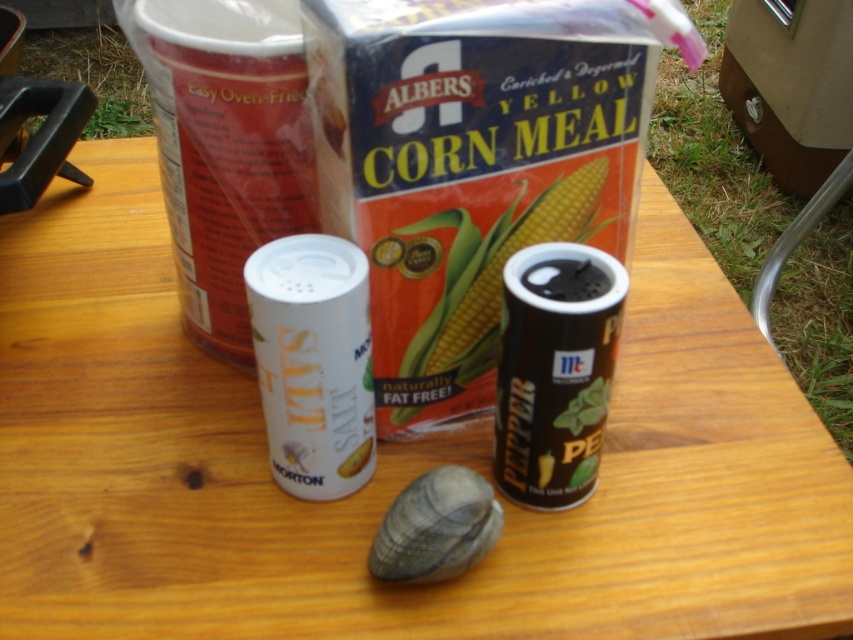
Question: Which of the following is the closest to the observer?

Choices:
 (A) (242, 84)
 (B) (534, 490)
 (C) (341, 308)

Answer: (C)

Question: Which of the following is the farthest from the observer?

Choices:
 (A) (409, 566)
 (B) (334, 314)
 (C) (227, 84)

Answer: (C)

Question: Is white matte salt shaker at center to the left of gray matte shell at center from the viewer's perspective?

Choices:
 (A) yes
 (B) no

Answer: (A)

Question: Which point is farther from the camera taking this photo?

Choices:
 (A) (392, 506)
 (B) (370, 426)

Answer: (B)

Question: Can you confirm if black matte pepper shaker at center is positioned below white matte salt shaker at center?

Choices:
 (A) no
 (B) yes

Answer: (B)

Question: Can you confirm if white matte cup at upper left is smaller than gray matte shell at center?

Choices:
 (A) yes
 (B) no

Answer: (B)